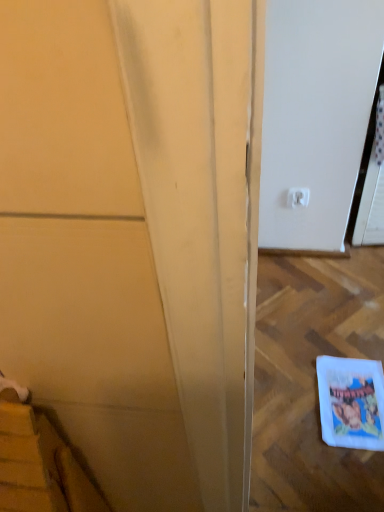
The image size is (384, 512). Find the location of `free space above white paper comic book at lower right (from a real-world perspective)`. free space above white paper comic book at lower right (from a real-world perspective) is located at coordinates (358, 395).